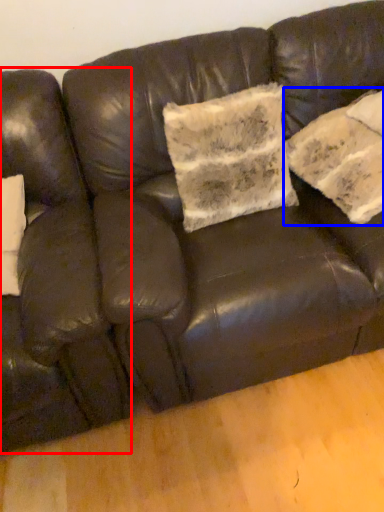
Question: Which point is further to the camera, armchair (highlighted by a red box) or pillow (highlighted by a blue box)?

Choices:
 (A) armchair
 (B) pillow

Answer: (B)